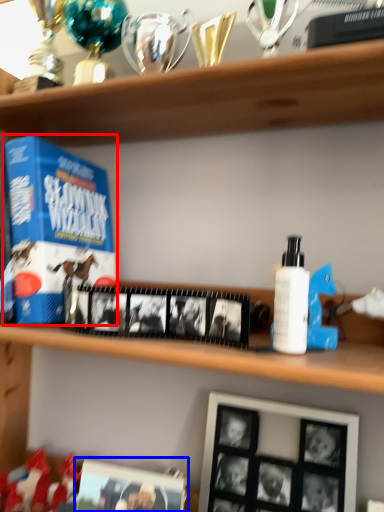
Question: Which object is further to the camera taking this photo, product (highlighted by a red box) or picture frame (highlighted by a blue box)?

Choices:
 (A) product
 (B) picture frame

Answer: (A)